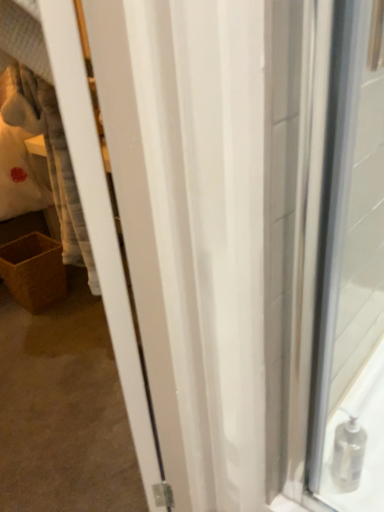
Question: Considering the positions of clear plastic soap dispenser at lower right and brown woven basket at lower left in the image, is clear plastic soap dispenser at lower right bigger or smaller than brown woven basket at lower left?

Choices:
 (A) small
 (B) big

Answer: (A)

Question: In the image, is clear plastic soap dispenser at lower right positioned in front of or behind brown woven basket at lower left?

Choices:
 (A) front
 (B) behind

Answer: (A)

Question: From their relative heights in the image, would you say clear plastic soap dispenser at lower right is taller or shorter than brown woven basket at lower left?

Choices:
 (A) tall
 (B) short

Answer: (B)

Question: From their relative heights in the image, would you say brown woven basket at lower left is taller or shorter than clear plastic soap dispenser at lower right?

Choices:
 (A) tall
 (B) short

Answer: (A)

Question: From a real-world perspective, is brown woven basket at lower left above or below clear plastic soap dispenser at lower right?

Choices:
 (A) below
 (B) above

Answer: (A)

Question: In the image, is brown woven basket at lower left on the left side or the right side of clear plastic soap dispenser at lower right?

Choices:
 (A) right
 (B) left

Answer: (B)

Question: Considering their positions, is brown woven basket at lower left located in front of or behind clear plastic soap dispenser at lower right?

Choices:
 (A) behind
 (B) front

Answer: (A)